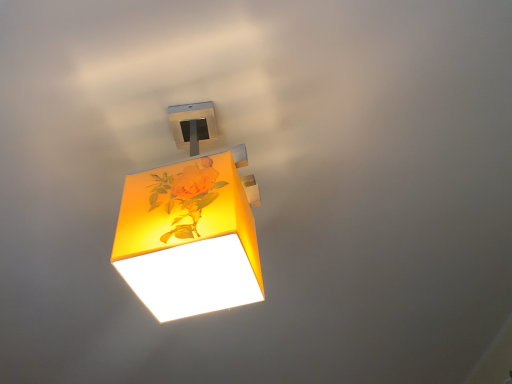
This screenshot has width=512, height=384. What are the coordinates of `matte yellow paper lampshade at upper center` in the screenshot? It's located at (191, 226).

Describe the element at coordinates (191, 226) in the screenshot. I see `matte yellow paper lampshade at upper center` at that location.

This screenshot has width=512, height=384. Identify the location of matte yellow paper lampshade at upper center. (191, 226).